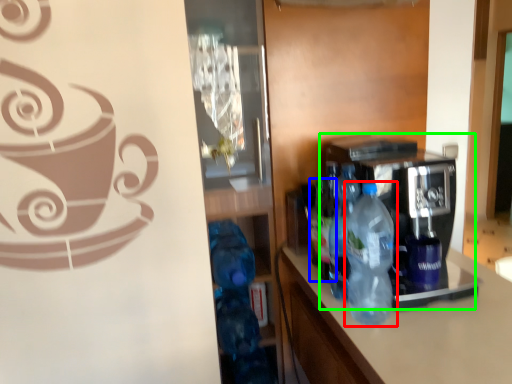
Question: Which object is positioned farthest from bottle (highlighted by a red box)? Select from bottle (highlighted by a blue box) and coffee machine (highlighted by a green box).

Choices:
 (A) bottle
 (B) coffee machine

Answer: (A)